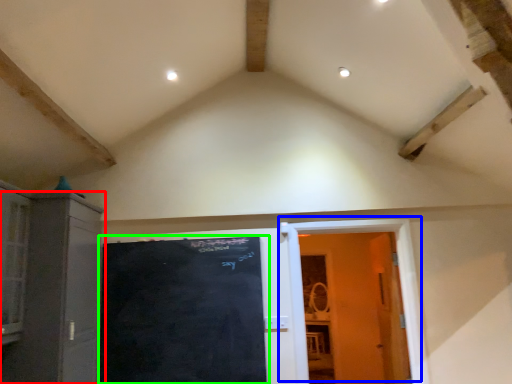
Question: Which is farther away from cabinetry (highlighted by a red box)? door (highlighted by a blue box) or bulletin board (highlighted by a green box)?

Choices:
 (A) door
 (B) bulletin board

Answer: (A)